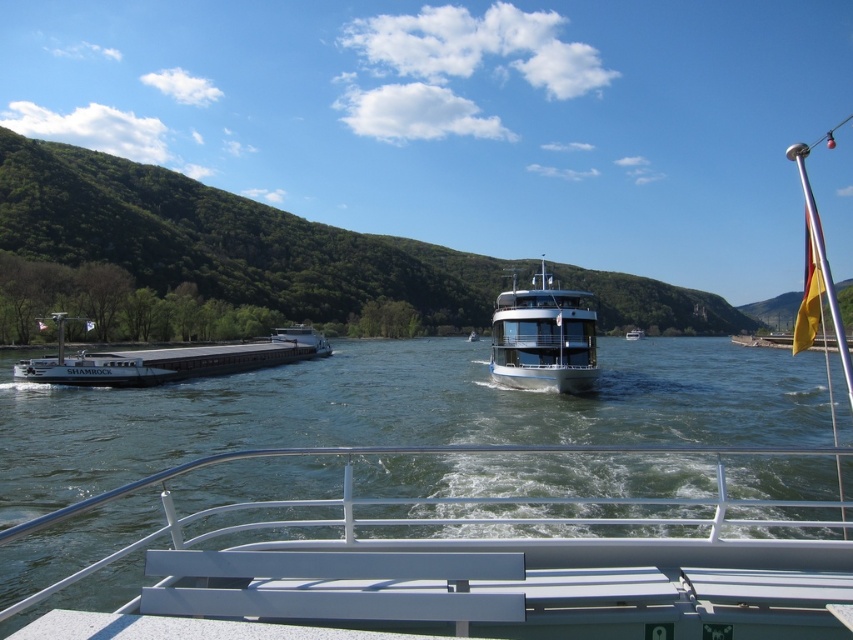
Question: Which point is farther to the camera?

Choices:
 (A) (141, 374)
 (B) (535, 362)
 (C) (643, 333)

Answer: (C)

Question: Can you confirm if green water at center is wider than matte gray barge at left?

Choices:
 (A) yes
 (B) no

Answer: (A)

Question: Can you confirm if green water at center is positioned above matte gray barge at left?

Choices:
 (A) yes
 (B) no

Answer: (B)

Question: Among these points, which one is nearest to the camera?

Choices:
 (A) (38, 358)
 (B) (573, 390)
 (C) (193, 493)

Answer: (C)

Question: Does metallic silver boat at center appear on the right side of matte gray barge at left?

Choices:
 (A) yes
 (B) no

Answer: (A)

Question: Which is farther from the green water at center?

Choices:
 (A) white glossy boat at center
 (B) matte gray barge at left
 (C) metallic silver boat at center

Answer: (A)